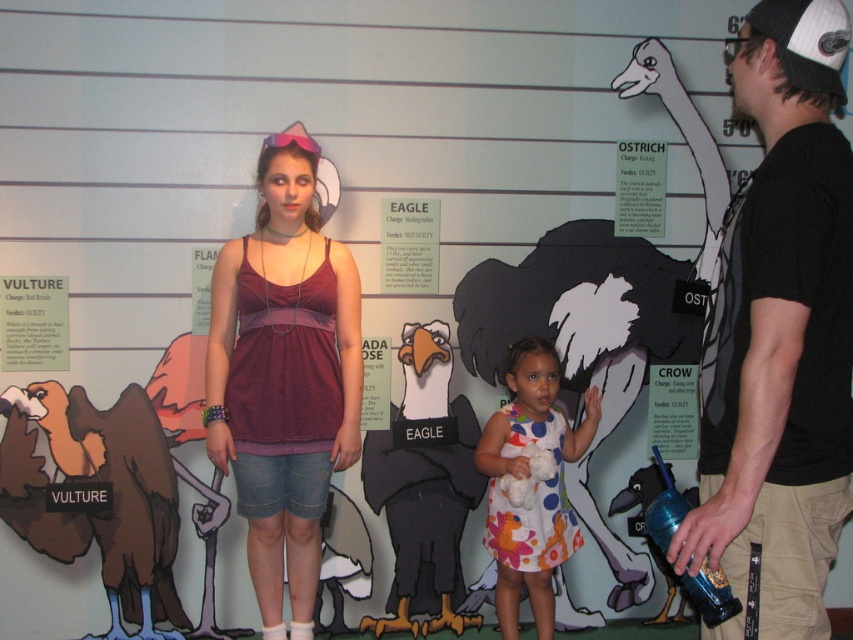
From the picture: Who is shorter, matte purple tank top at center or white paper ostrich at upper right?

white paper ostrich at upper right is shorter.

Which of these two, matte purple tank top at center or white paper ostrich at upper right, stands taller?

matte purple tank top at center is taller.

Is point (204, 419) behind point (648, 154)?

No, (204, 419) is in front of (648, 154).

This screenshot has width=853, height=640. I want to click on matte purple tank top at center, so 283,378.

Is matte purple tank top at center above white polka dot dress at center?

Yes.

Does matte purple tank top at center come in front of white polka dot dress at center?

Yes, matte purple tank top at center is closer to the viewer.

At what (x,y) coordinates should I click in order to perform the action: click on matte purple tank top at center. Please return your answer as a coordinate pair (x, y). Looking at the image, I should click on (283, 378).

Is matte purple tank top at center below brown matte vulture at left?

Incorrect, matte purple tank top at center is not positioned below brown matte vulture at left.

Describe the element at coordinates (283, 378) in the screenshot. The image size is (853, 640). I see `matte purple tank top at center` at that location.

Is point (287, 483) positioned in front of point (111, 436)?

Yes, it is.

This screenshot has width=853, height=640. In order to click on matte purple tank top at center in this screenshot , I will do `click(283, 378)`.